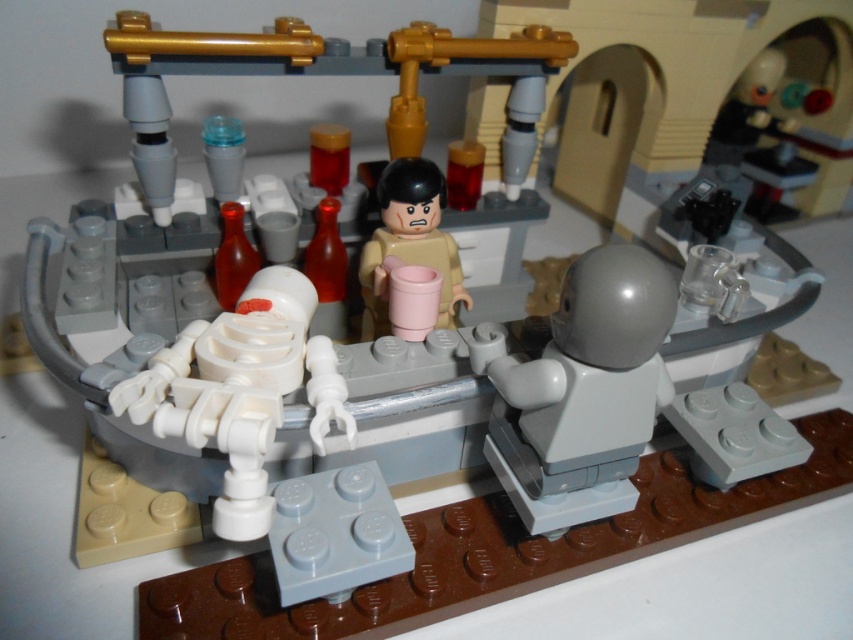
Can you confirm if gray matte astronaut helmet at center is positioned to the right of tan matte cup at center?

Yes, gray matte astronaut helmet at center is to the right of tan matte cup at center.

The image size is (853, 640). Describe the element at coordinates (581, 392) in the screenshot. I see `gray matte astronaut helmet at center` at that location.

I want to click on gray matte astronaut helmet at center, so click(581, 392).